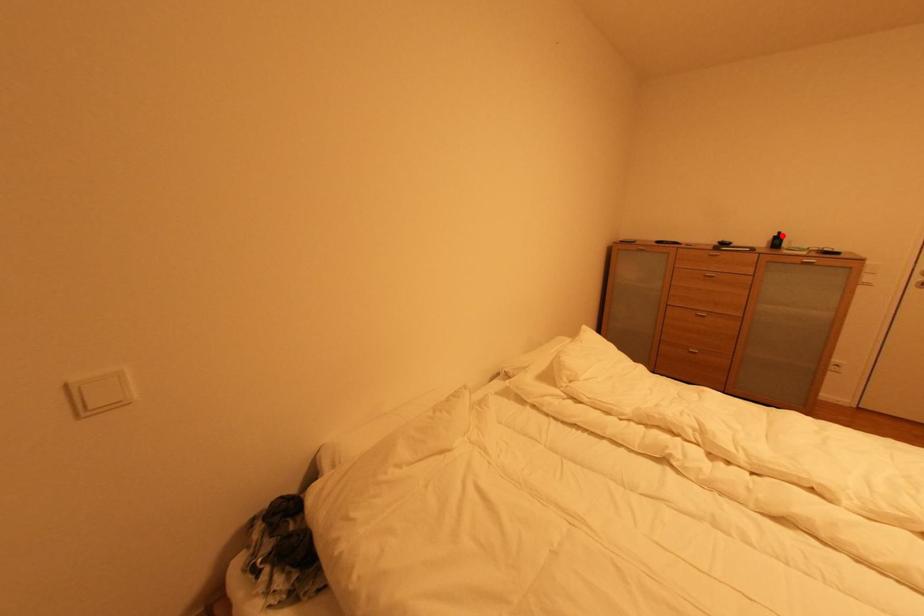
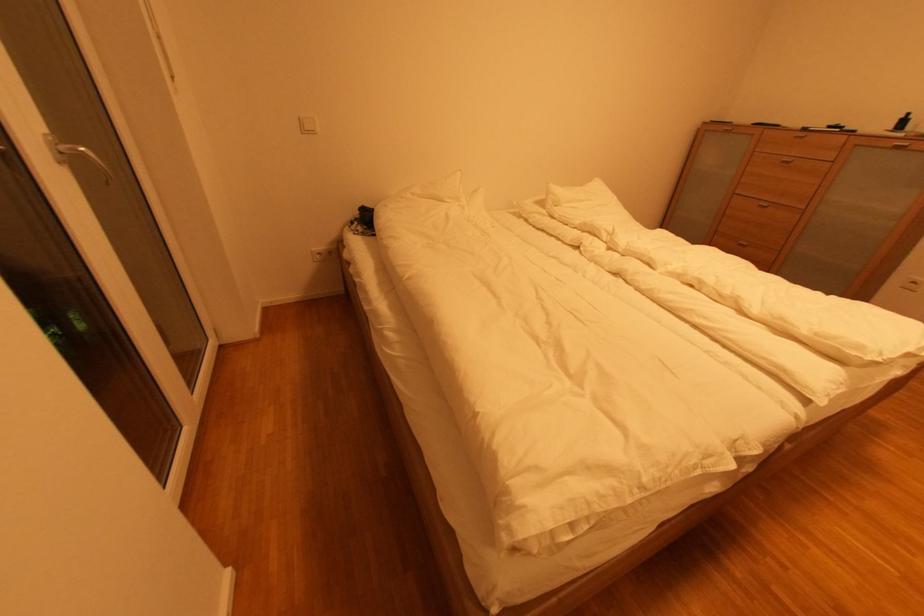
Question: I am providing you with two images of the same scene from different viewpoints. Given a red point in image1, look at the same physical point in image2. Is it:

Choices:
 (A) Closer to the viewpoint
 (B) Farther from the viewpoint

Answer: (B)